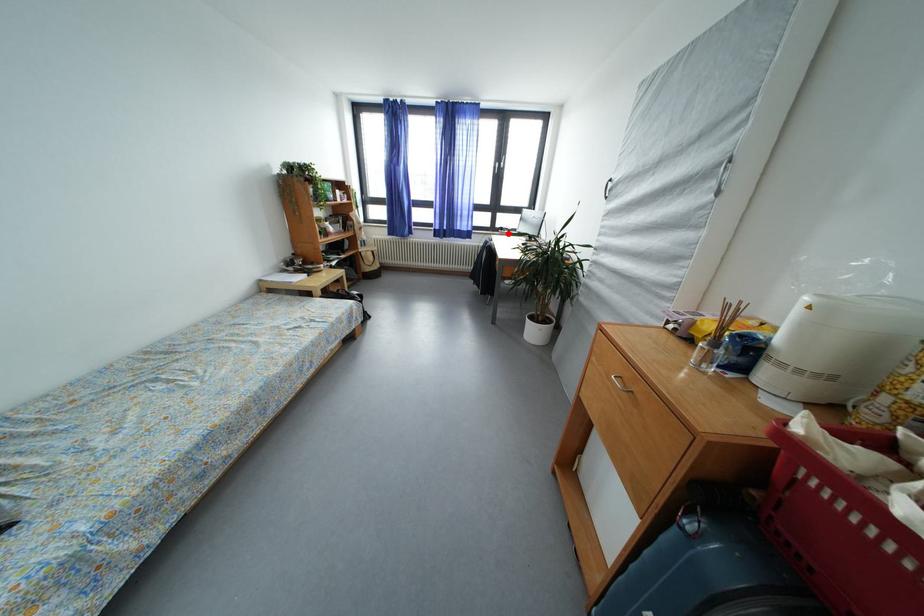
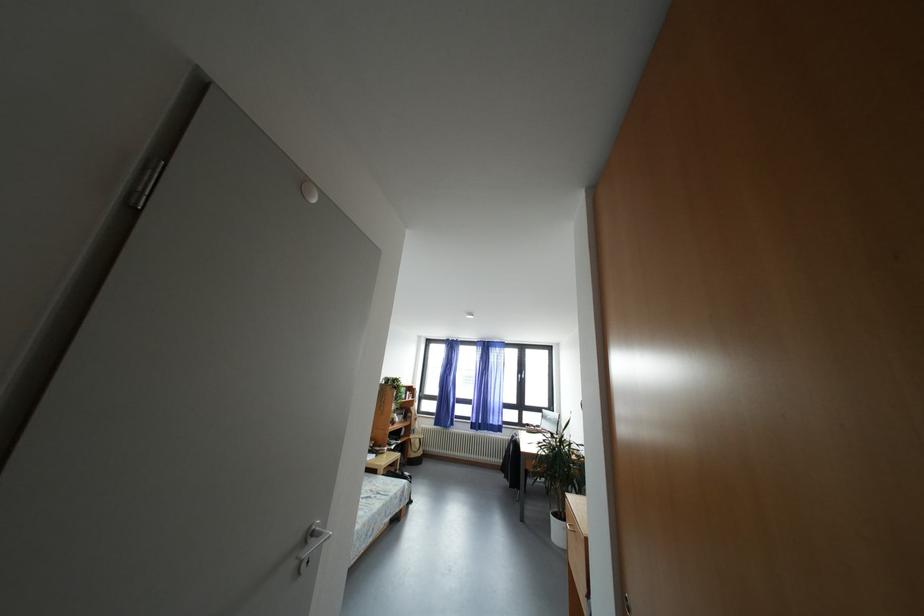
Question: I am providing you with two images of the same scene from different viewpoints. Given a red point in image1, look at the same physical point in image2. Is it:

Choices:
 (A) Closer to the viewpoint
 (B) Farther from the viewpoint

Answer: (B)